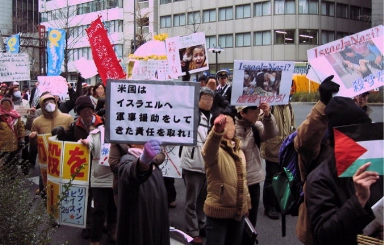
Find the location of a particular element. Image resolution: width=384 pixels, height=246 pixels. yellow poster is located at coordinates tap(73, 165), tap(56, 162), tap(55, 191).